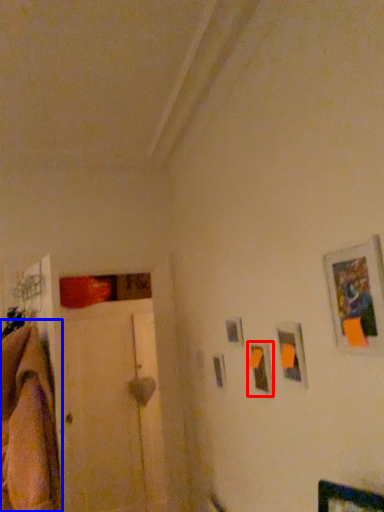
Question: Which point is closer to the camera, picture frame (highlighted by a red box) or blanket (highlighted by a blue box)?

Choices:
 (A) picture frame
 (B) blanket

Answer: (B)